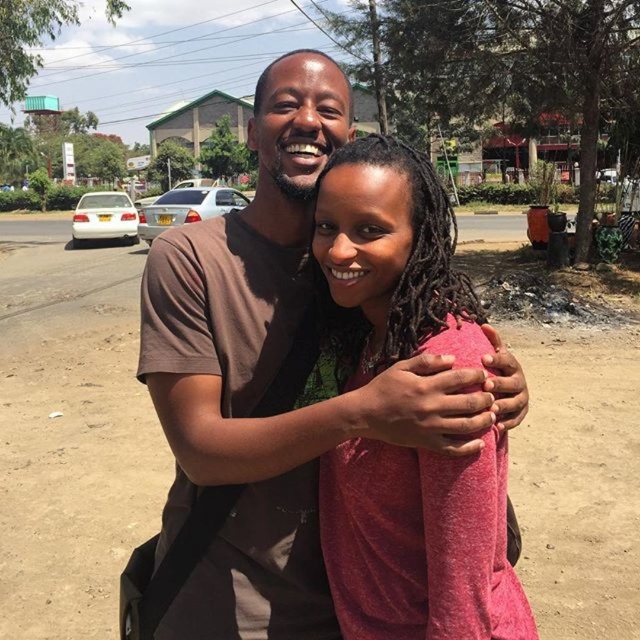
Can you confirm if brown cotton shirt at center is positioned to the left of matte pink shirt at center?

Yes, brown cotton shirt at center is to the left of matte pink shirt at center.

Can you confirm if brown cotton shirt at center is positioned to the right of matte pink shirt at center?

Incorrect, brown cotton shirt at center is not on the right side of matte pink shirt at center.

Is point (289, 145) in front of point (372, 260)?

That is False.

This screenshot has width=640, height=640. Identify the location of brown cotton shirt at center. (273, 385).